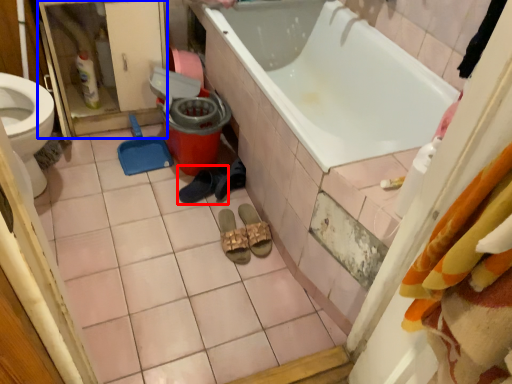
Question: Which point is closer to the camera, footwear (highlighted by a red box) or screen door (highlighted by a blue box)?

Choices:
 (A) footwear
 (B) screen door

Answer: (B)